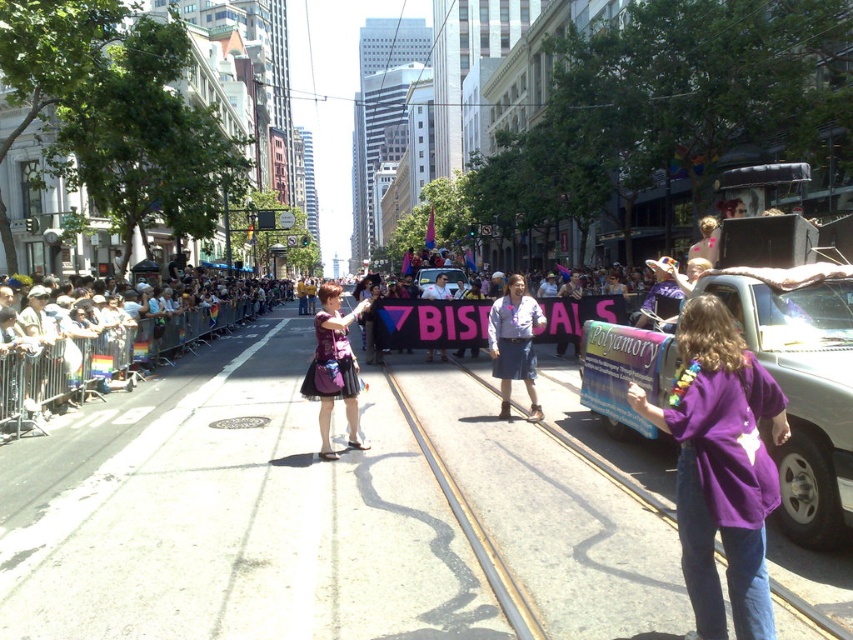
You are a photographer standing at the corner of the street. You want to capture the purple cotton shirt at center in your shot. Where should you position your camera to ensure it is centered in the frame?

To center the purple cotton shirt at center in your frame, position your camera so that it aligns with the coordinates provided at point (721, 467).

You are a participant in the parade and want to see the banner held by the woman in the purple dress. The banner is behind the white plastic barrier at left and the denim skirt at center. Which object is blocking your view more due to its height?

The white plastic barrier at left is much taller than the denim skirt at center, so it is blocking your view more due to its height.

Based on the photo, you are a photographer at the event and want to capture both the purple cotton shirt at center and the denim skirt at center in a single frame. Which object should you focus on to ensure both are in the frame without moving the camera?

The purple cotton shirt at center is smaller than the denim skirt at center, so focusing on the purple cotton shirt at center would allow the larger denim skirt at center to remain in the frame as well.